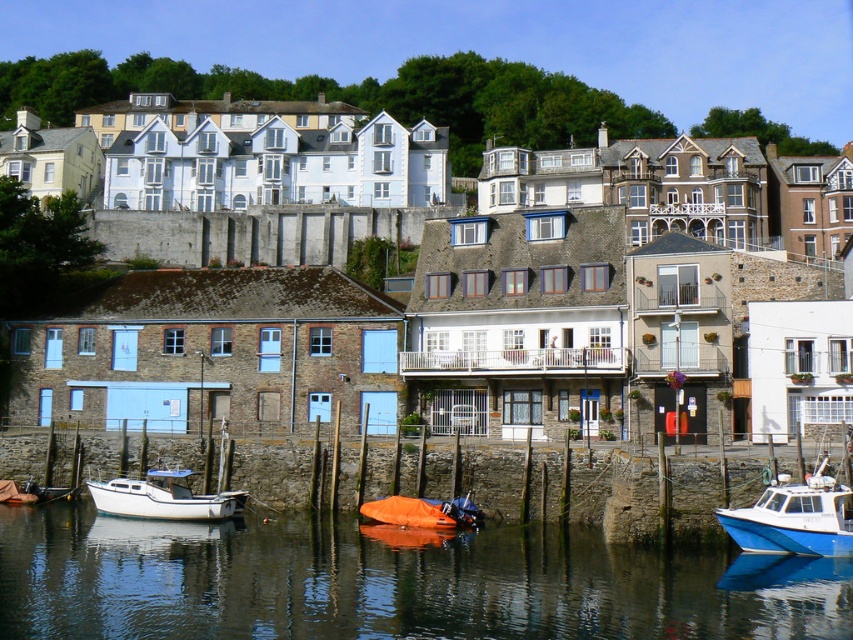
You are a photographer standing on the dock and want to capture both the blue glossy boat at lower right and the white matte boat at lower left in a single shot. Which boat should you position closer to the center of your camera frame to ensure both are fully visible?

The blue glossy boat at lower right should be positioned closer to the center of your camera frame because it is overlapping the white matte boat at lower left, so moving it towards the center will help both boats fit within the frame without being cut off.

You are a dock attendant who needs to allocate space for two boats. The white matte boat at lower left and the orange tarpaulin boat at lower center are both docked. Which boat requires more space to moor?

The orange tarpaulin boat at lower center requires more space to moor since it is larger than the white matte boat at lower left.